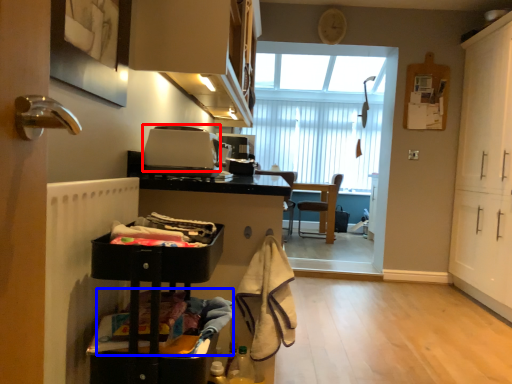
Question: Which object appears farthest to the camera in this image, appliance (highlighted by a red box) or laundry (highlighted by a blue box)?

Choices:
 (A) appliance
 (B) laundry

Answer: (A)